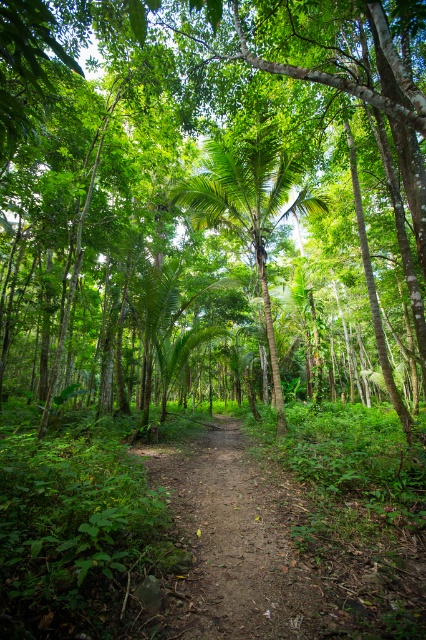
You are standing at the center of the forest path and see a point marked at coordinates (x=192, y=182). What object is located at that point?

The point at coordinates (x=192, y=182) indicates a green leafy tree at center.